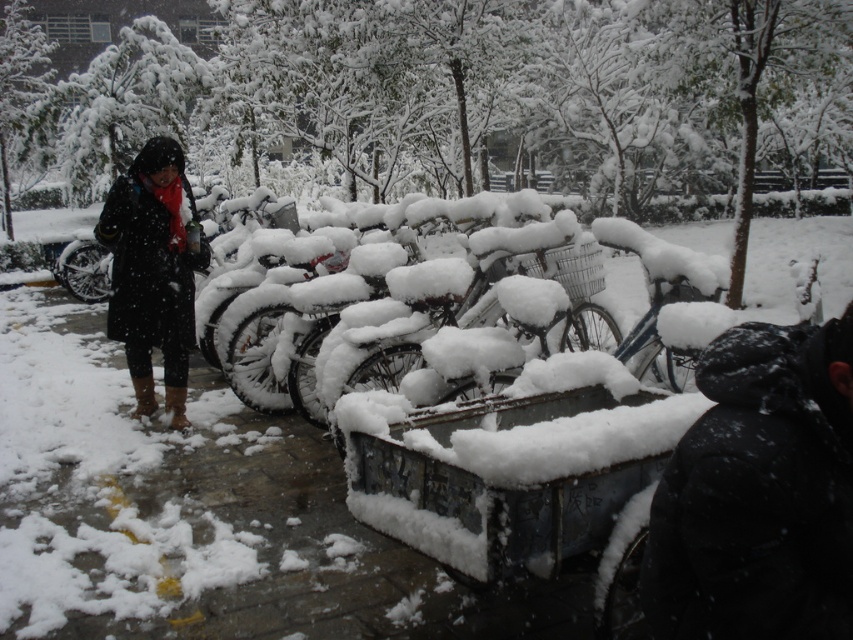
Between black matte coat at left and snow-covered metal bicycle at center, which one is positioned lower?

snow-covered metal bicycle at center is below.

Who is shorter, black matte coat at left or snow-covered metal bicycle at center?

With less height is snow-covered metal bicycle at center.

Where is `black matte coat at left`? Image resolution: width=853 pixels, height=640 pixels. black matte coat at left is located at coordinates (154, 272).

Can you confirm if black fuzzy hat at upper right is positioned above metallic gray cart at center?

Indeed, black fuzzy hat at upper right is positioned over metallic gray cart at center.

Is black fuzzy hat at upper right smaller than metallic gray cart at center?

Correct, black fuzzy hat at upper right occupies less space than metallic gray cart at center.

Which is behind, point (727, 406) or point (508, 561)?

Point (508, 561)

Locate an element on the screen. The image size is (853, 640). black fuzzy hat at upper right is located at coordinates (759, 493).

Is metallic gray cart at center further to the viewer compared to snow-covered metal bicycle at center?

No, metallic gray cart at center is in front of snow-covered metal bicycle at center.

Does metallic gray cart at center appear on the right side of snow-covered metal bicycle at center?

No, metallic gray cart at center is not to the right of snow-covered metal bicycle at center.

Which is behind, point (462, 468) or point (471, 368)?

Point (471, 368)

Identify the location of metallic gray cart at center. The width and height of the screenshot is (853, 640). (512, 465).